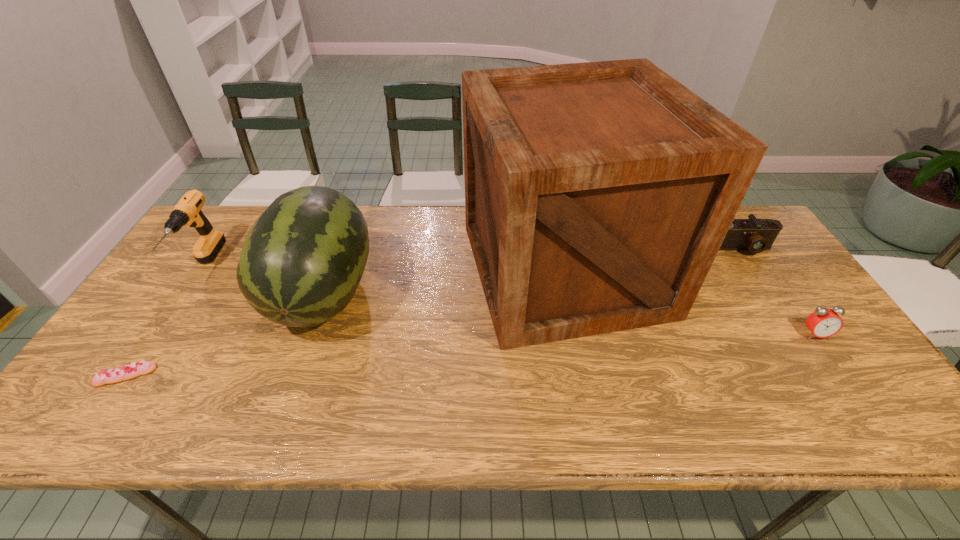
Where is `the third object from right to left`? This screenshot has height=540, width=960. the third object from right to left is located at coordinates (597, 195).

Where is `the tallest object`? the tallest object is located at coordinates (597, 195).

Where is `watermelon`? The image size is (960, 540). watermelon is located at coordinates (302, 261).

This screenshot has height=540, width=960. Identify the location of the fourth object from right to left. (302, 261).

The image size is (960, 540). In order to click on the third tallest object in this screenshot , I will do `click(188, 212)`.

The image size is (960, 540). In order to click on camera in this screenshot , I will do `click(756, 235)`.

Image resolution: width=960 pixels, height=540 pixels. I want to click on alarm clock, so click(x=823, y=322).

I want to click on eclair, so click(135, 369).

Image resolution: width=960 pixels, height=540 pixels. Find the location of `the shortest object`. the shortest object is located at coordinates (135, 369).

Find the location of a particular element. vacant space located on the left of the tallest object is located at coordinates (356, 269).